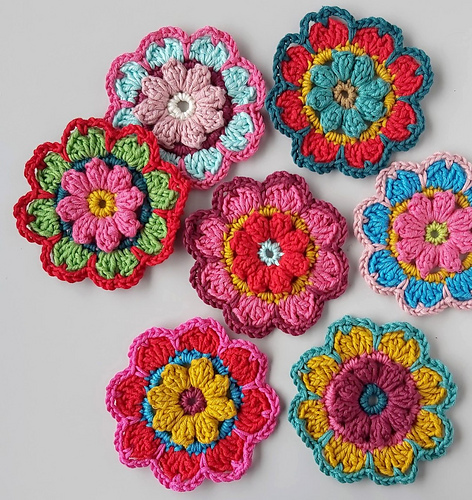
The image size is (472, 500). In order to click on blanket in this screenshot , I will do 363,147.